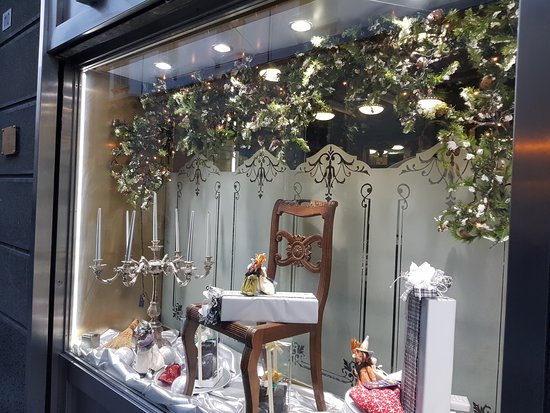
The width and height of the screenshot is (550, 413). I want to click on chair, so click(238, 333).